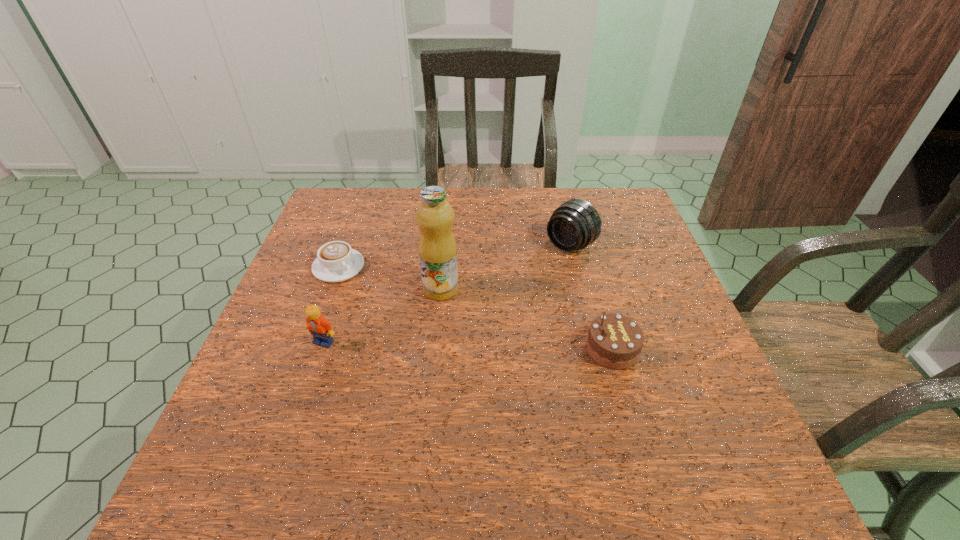
Where is `the third shortest object`? the third shortest object is located at coordinates (320, 328).

What are the coordinates of `the fourth tallest object` in the screenshot? It's located at (614, 341).

You are a GUI agent. You are given a task and a screenshot of the screen. Output one action in this format:
    pyautogui.click(x=<x>, y=<y>)
    Task: Click on the cappuccino
    
    Given the screenshot: What is the action you would take?
    pyautogui.click(x=336, y=261)

The image size is (960, 540). What are the coordinates of `the second tallest object` in the screenshot? It's located at (575, 224).

Locate an element on the screen. the third object from right to left is located at coordinates (437, 247).

I want to click on the tallest object, so click(x=437, y=247).

This screenshot has height=540, width=960. Find the location of `free space located on the front-facing side of the Lego`. free space located on the front-facing side of the Lego is located at coordinates (307, 392).

I want to click on free space located on the back of the fourth tallest object, so click(593, 282).

Where is `free space located with the handle on the right side of the cappuccino`? The image size is (960, 540). free space located with the handle on the right side of the cappuccino is located at coordinates (445, 355).

Locate an element on the screen. Image resolution: width=960 pixels, height=540 pixels. vacant region located 0.240m with the handle on the right side of the cappuccino is located at coordinates (413, 328).